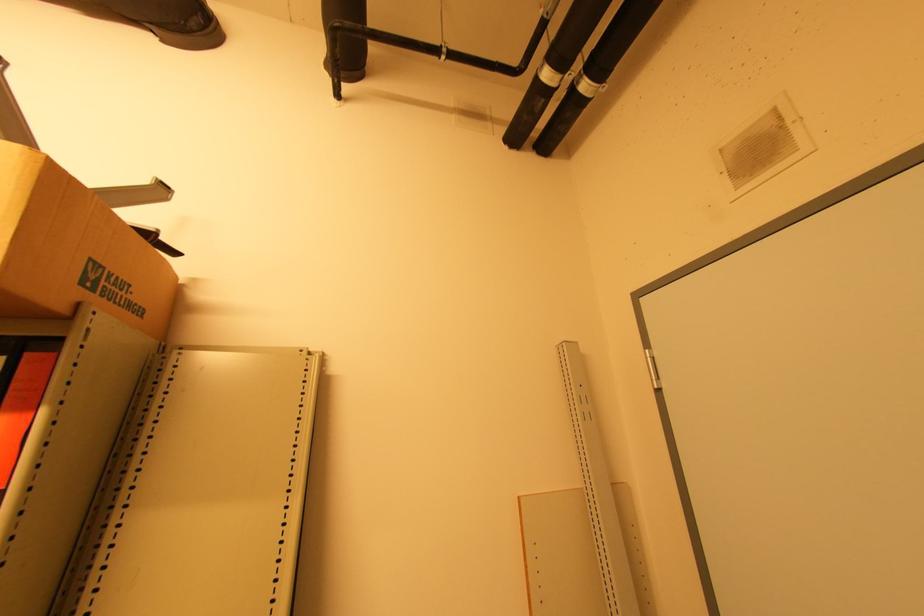
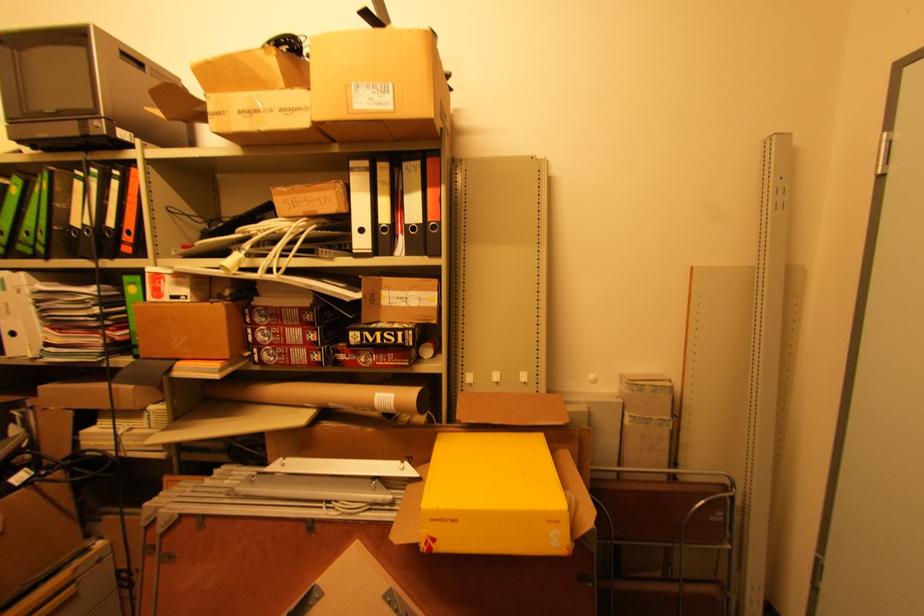
Based on the continuous images, in which direction is the camera rotating?

The camera rotated toward left-down.